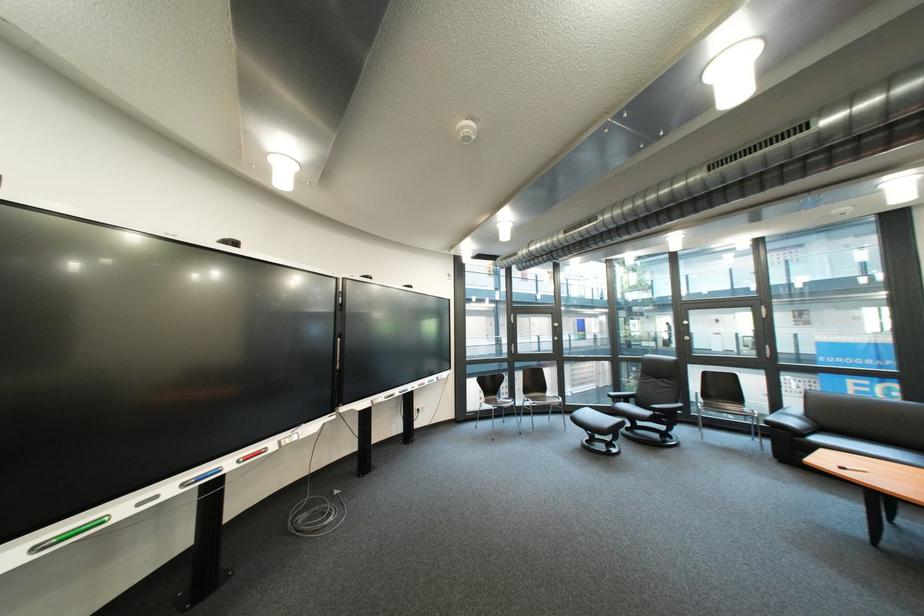
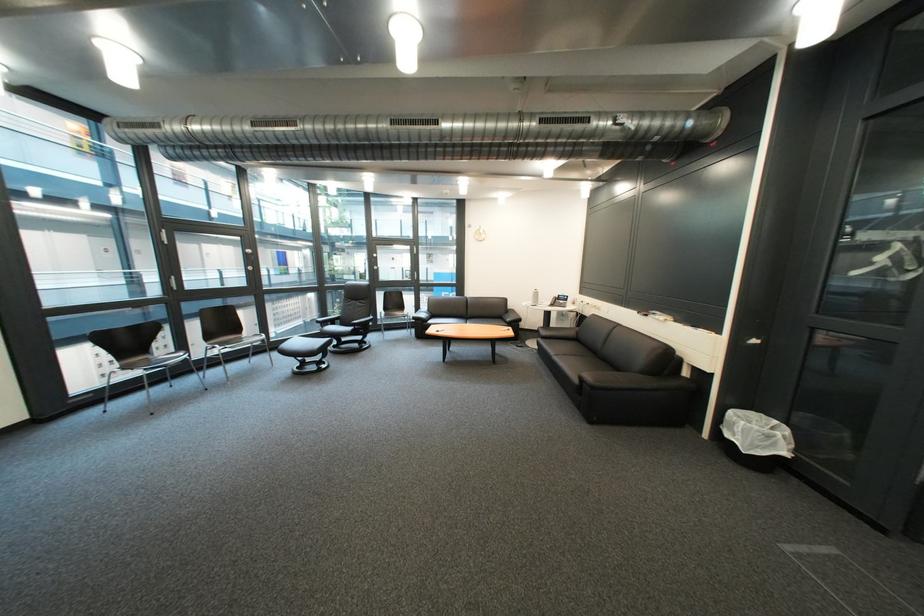
In the second image, find the point that corresponds to pixel 497 400 in the first image.

(131, 368)